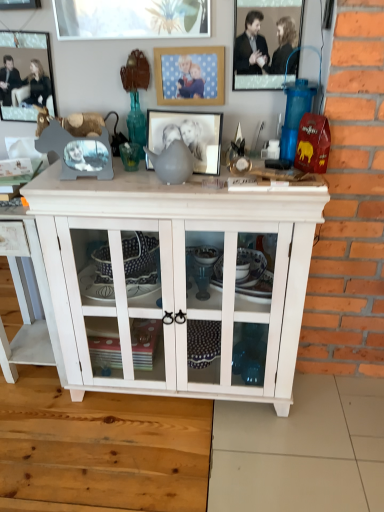
Question: Is matte gray picture frame at center, marked as the 3th picture frame in a left-to-right arrangement, looking in the opposite direction of metallic silver picture frame at upper center, the 5th picture frame viewed from the left?

Choices:
 (A) yes
 (B) no

Answer: (B)

Question: Does matte gray picture frame at center, marked as the 3th picture frame in a right-to-left arrangement, come in front of metallic silver picture frame at upper center, the 5th picture frame viewed from the left?

Choices:
 (A) no
 (B) yes

Answer: (B)

Question: Is matte gray picture frame at center, marked as the 3th picture frame in a right-to-left arrangement, located outside metallic silver picture frame at upper center, which ranks as the 1th picture frame in right-to-left order?

Choices:
 (A) yes
 (B) no

Answer: (A)

Question: Is matte gray picture frame at center, marked as the 3th picture frame in a right-to-left arrangement, to the left of metallic silver picture frame at upper center, which ranks as the 1th picture frame in right-to-left order, from the viewer's perspective?

Choices:
 (A) yes
 (B) no

Answer: (A)

Question: Would you say matte gray picture frame at center, marked as the 3th picture frame in a right-to-left arrangement, contains metallic silver picture frame at upper center, the 5th picture frame viewed from the left?

Choices:
 (A) yes
 (B) no

Answer: (B)

Question: Does matte gray picture frame at center, marked as the 3th picture frame in a right-to-left arrangement, have a greater width compared to metallic silver picture frame at upper center, the 5th picture frame viewed from the left?

Choices:
 (A) yes
 (B) no

Answer: (A)

Question: Can you confirm if metallic silver picture frame at upper center, which ranks as the 1th picture frame in right-to-left order, is wider than brushed metal picture frame at upper left, arranged as the fourth picture frame when viewed from the right?

Choices:
 (A) yes
 (B) no

Answer: (B)

Question: From a real-world perspective, is metallic silver picture frame at upper center, which ranks as the 1th picture frame in right-to-left order, located higher than brushed metal picture frame at upper left, the second picture frame from the left?

Choices:
 (A) yes
 (B) no

Answer: (B)

Question: Is metallic silver picture frame at upper center, which ranks as the 1th picture frame in right-to-left order, positioned with its back to brushed metal picture frame at upper left, the second picture frame from the left?

Choices:
 (A) no
 (B) yes

Answer: (A)

Question: Considering the relative sizes of metallic silver picture frame at upper center, which ranks as the 1th picture frame in right-to-left order, and brushed metal picture frame at upper left, the second picture frame from the left, in the image provided, is metallic silver picture frame at upper center, which ranks as the 1th picture frame in right-to-left order, thinner than brushed metal picture frame at upper left, the second picture frame from the left,?

Choices:
 (A) no
 (B) yes

Answer: (B)

Question: Can you confirm if metallic silver picture frame at upper center, which ranks as the 1th picture frame in right-to-left order, is bigger than brushed metal picture frame at upper left, arranged as the fourth picture frame when viewed from the right?

Choices:
 (A) no
 (B) yes

Answer: (A)

Question: Can we say metallic silver picture frame at upper center, which ranks as the 1th picture frame in right-to-left order, lies outside brushed metal picture frame at upper left, arranged as the fourth picture frame when viewed from the right?

Choices:
 (A) no
 (B) yes

Answer: (B)

Question: Is metallic silver picture frame at upper left, the 5th picture frame viewed from the right, bigger than matte gray picture frame at center, marked as the 3th picture frame in a left-to-right arrangement?

Choices:
 (A) no
 (B) yes

Answer: (A)